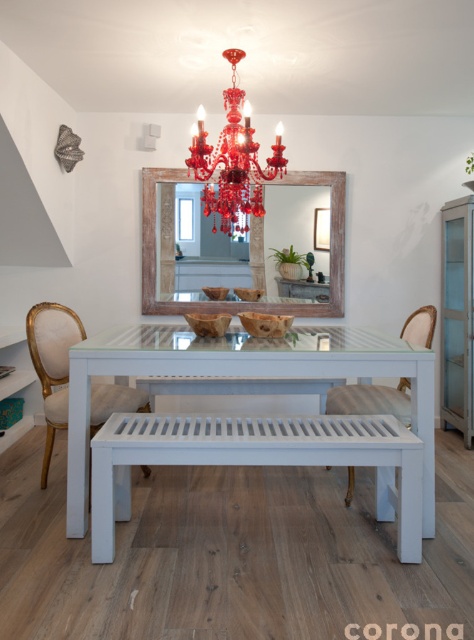
Question: Does rustic wood mirror at center lie behind matte white chair at center?

Choices:
 (A) no
 (B) yes

Answer: (B)

Question: Which object is closer to the camera taking this photo?

Choices:
 (A) shiny crystal chandelier at upper center
 (B) white painted wood table at center
 (C) matte white chair at center
 (D) gold upholstered chair at left

Answer: (B)

Question: Which point appears farthest from the camera in this image?

Choices:
 (A) (327, 403)
 (B) (337, 221)
 (C) (67, 369)

Answer: (B)

Question: Which of these objects is positioned closest to the matte white chair at center?

Choices:
 (A) rustic wood mirror at center
 (B) shiny crystal chandelier at upper center
 (C) white painted wood table at center

Answer: (C)

Question: Observing the image, what is the correct spatial positioning of white painted wood table at center in reference to shiny crystal chandelier at upper center?

Choices:
 (A) left
 (B) right

Answer: (B)

Question: In this image, where is rustic wood mirror at center located relative to shiny crystal chandelier at upper center?

Choices:
 (A) below
 (B) above

Answer: (A)